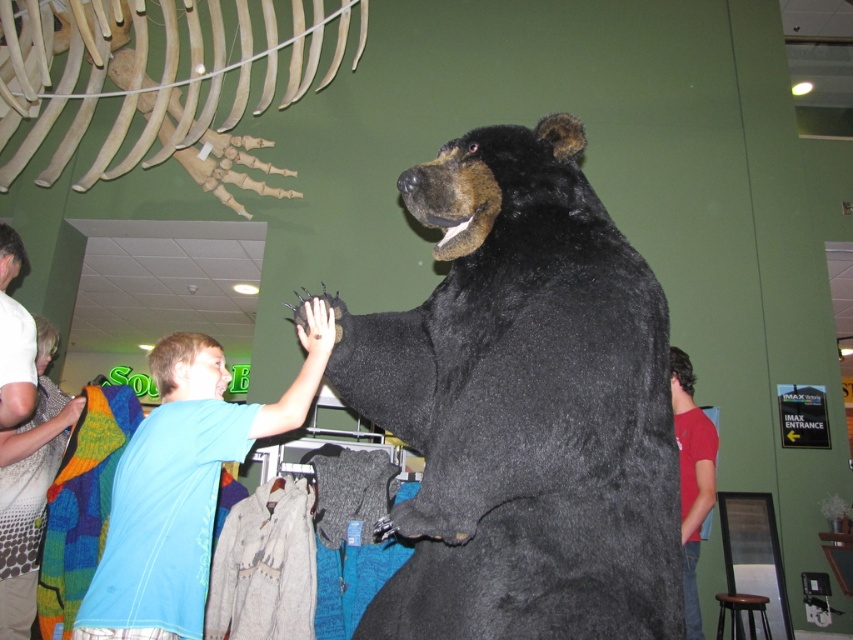
Question: Estimate the real-world distances between objects in this image. Which object is closer to the red cotton shirt at right?

Choices:
 (A) knitted sweater at left
 (B) blue cotton shirt at lower left

Answer: (B)

Question: Where is black plush bear at center located in relation to red cotton shirt at right in the image?

Choices:
 (A) above
 (B) below

Answer: (A)

Question: Is black plush bear at center wider than blue cotton shirt at lower left?

Choices:
 (A) yes
 (B) no

Answer: (A)

Question: Considering the real-world distances, which object is closest to the black plush bear at center?

Choices:
 (A) red cotton shirt at right
 (B) blue cotton shirt at lower left

Answer: (B)

Question: Is the position of black plush bear at center more distant than that of red cotton shirt at right?

Choices:
 (A) yes
 (B) no

Answer: (B)

Question: Estimate the real-world distances between objects in this image. Which object is closer to the blue cotton shirt at lower left?

Choices:
 (A) red cotton shirt at right
 (B) knitted sweater at left
 (C) black plush bear at center

Answer: (C)